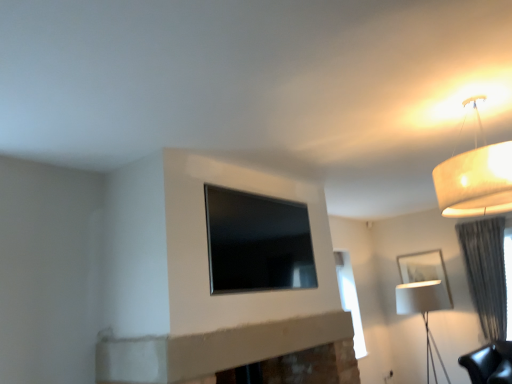
Find the location of `vacant region under black glass window at center (from a real-world perspective)`. vacant region under black glass window at center (from a real-world perspective) is located at coordinates point(268,317).